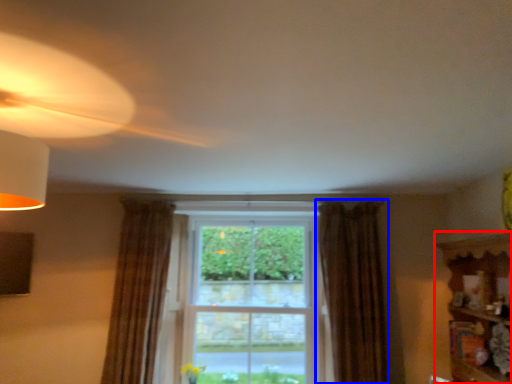
Question: Which object is further to the camera taking this photo, shelf (highlighted by a red box) or curtain (highlighted by a blue box)?

Choices:
 (A) shelf
 (B) curtain

Answer: (B)